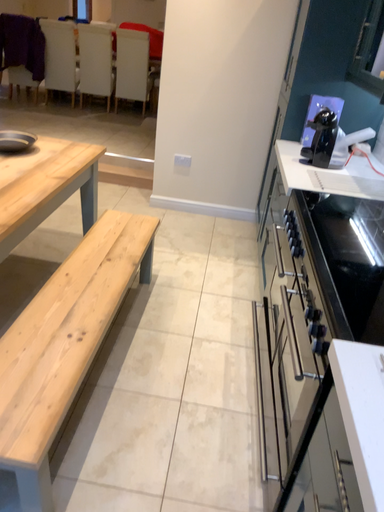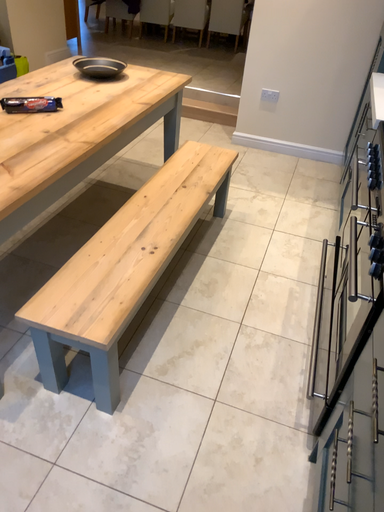
Question: How did the camera likely rotate when shooting the video?

Choices:
 (A) rotated upward
 (B) rotated downward

Answer: (B)